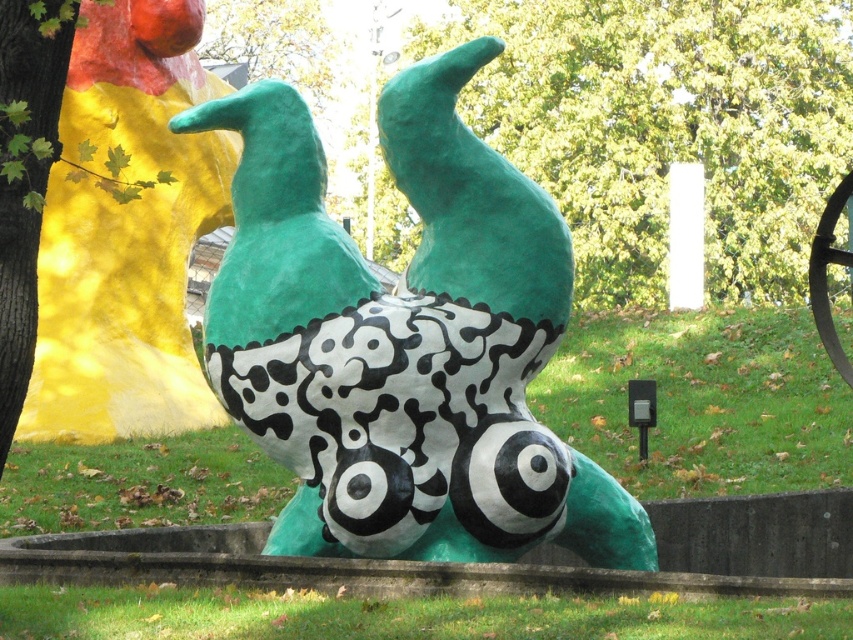
You are an artist planning to paint a mural that includes both the matte green sculpture at center and the green matte tree at upper center. Which object should you paint first if you want to follow the rule of starting with the smaller object to ensure proper perspective?

The matte green sculpture at center should be painted first because it is smaller than the green matte tree at upper center, allowing for proper perspective by starting with smaller elements.

You are standing in a park and see the matte green sculpture at center. If you want to take a photo of it with your phone, which has a maximum zoom range of 10 meters, will you be able to capture the entire sculpture without moving closer?

The matte green sculpture at center is 13.10 meters away from the viewer. Since your phone has a maximum zoom range of 10 meters, you will not be able to capture the entire sculpture without moving closer.

Based on the scene description, what object is located at the coordinates point (403, 340)?

The point (403, 340) corresponds to the matte green sculpture at center.